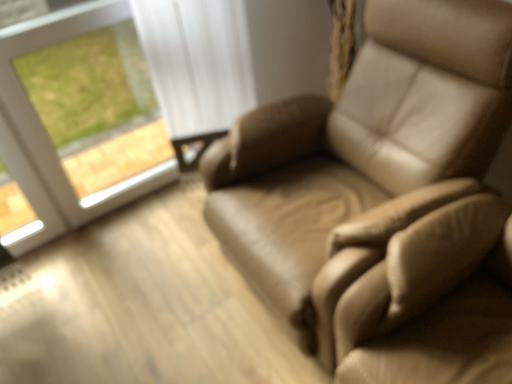
This screenshot has width=512, height=384. Describe the element at coordinates (78, 118) in the screenshot. I see `white glass window at upper left` at that location.

Locate an element on the screen. Image resolution: width=512 pixels, height=384 pixels. white glass window at upper left is located at coordinates (78, 118).

Describe the element at coordinates (382, 200) in the screenshot. I see `leather chair at right` at that location.

This screenshot has height=384, width=512. Find the location of `leather chair at right`. leather chair at right is located at coordinates (382, 200).

In order to face leather chair at right, should I rotate leftwards or rightwards?

To face it directly, rotate right by 11.571 degrees.

Where is `white glass window at upper left`? This screenshot has width=512, height=384. white glass window at upper left is located at coordinates (78, 118).

Considering the positions of objects white glass window at upper left and leather chair at right in the image provided, who is more to the right, white glass window at upper left or leather chair at right?

leather chair at right is more to the right.

Is white glass window at upper left in front of or behind leather chair at right in the image?

In the image, white glass window at upper left appears behind leather chair at right.

Considering the points (84, 23) and (407, 369), which point is in front, point (84, 23) or point (407, 369)?

Point (407, 369)

Consider the image. From the image's perspective, is white glass window at upper left on top of leather chair at right?

Yes, from the image's perspective, white glass window at upper left is above leather chair at right.

From a real-world perspective, is white glass window at upper left under leather chair at right?

No, from a real-world perspective, white glass window at upper left is not beneath leather chair at right.

Which object is wider, white glass window at upper left or leather chair at right?

With larger width is leather chair at right.

Consider the image. In terms of height, does white glass window at upper left look taller or shorter compared to leather chair at right?

white glass window at upper left is taller than leather chair at right.

From the picture: Who is bigger, white glass window at upper left or leather chair at right?

With larger size is leather chair at right.

Do you think white glass window at upper left is within leather chair at right, or outside of it?

white glass window at upper left is not inside leather chair at right, it's outside.

Is there a large distance between white glass window at upper left and leather chair at right?

white glass window at upper left is positioned a significant distance from leather chair at right.

Does white glass window at upper left turn towards leather chair at right?

Yes, white glass window at upper left faces towards leather chair at right.

Identify the location of chair on the right of white glass window at upper left. (382, 200).

Which is more to the right, leather chair at right or white glass window at upper left?

leather chair at right is more to the right.

Is leather chair at right further to the viewer compared to white glass window at upper left?

No, leather chair at right is in front of white glass window at upper left.

Is point (278, 234) in front of point (122, 22)?

Yes, point (278, 234) is in front of point (122, 22).

Looking at this image, from the image's perspective, is leather chair at right under white glass window at upper left?

Yes, from the image's perspective, leather chair at right is beneath white glass window at upper left.

From a real-world perspective, is leather chair at right beneath white glass window at upper left?

Yes, from a real-world perspective, leather chair at right is below white glass window at upper left.

Looking at their sizes, would you say leather chair at right is wider or thinner than white glass window at upper left?

Answer: Considering their sizes, leather chair at right looks broader than white glass window at upper left.

Consider the image. Who is shorter, leather chair at right or white glass window at upper left?

Standing shorter between the two is leather chair at right.

Can you confirm if leather chair at right is smaller than white glass window at upper left?

Actually, leather chair at right might be larger than white glass window at upper left.

Is leather chair at right not inside white glass window at upper left?

Yes, leather chair at right is outside of white glass window at upper left.

Is leather chair at right positioned far away from white glass window at upper left?

Absolutely, leather chair at right is distant from white glass window at upper left.

Is leather chair at right oriented towards white glass window at upper left?

No.

How far apart are leather chair at right and white glass window at upper left?

The distance of leather chair at right from white glass window at upper left is 3.33 feet.

This screenshot has height=384, width=512. I want to click on chair located below the white glass window at upper left (from the image's perspective), so click(382, 200).

This screenshot has width=512, height=384. Find the location of `window above the leather chair at right (from a real-world perspective)`. window above the leather chair at right (from a real-world perspective) is located at coordinates (78, 118).

Identify the location of window on the left of leather chair at right. (78, 118).